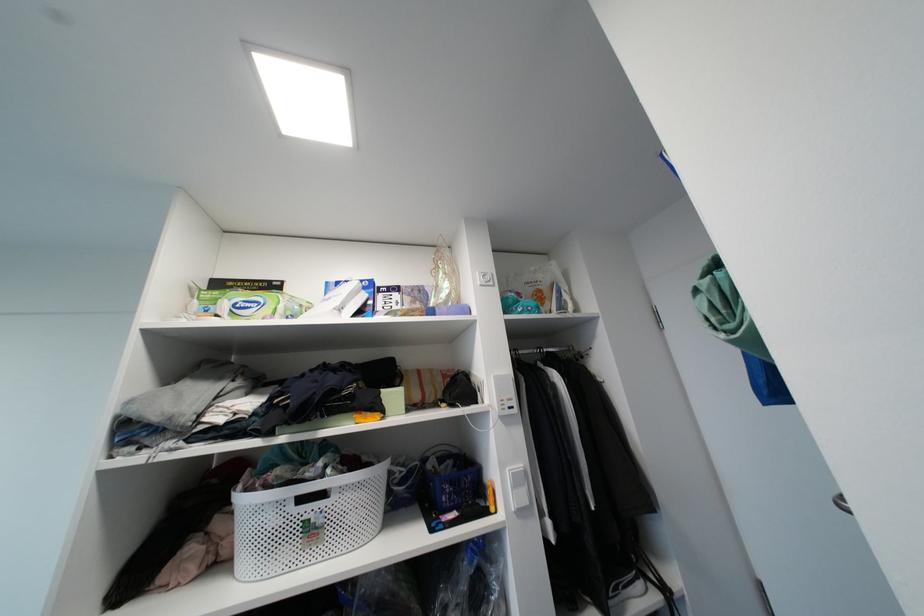
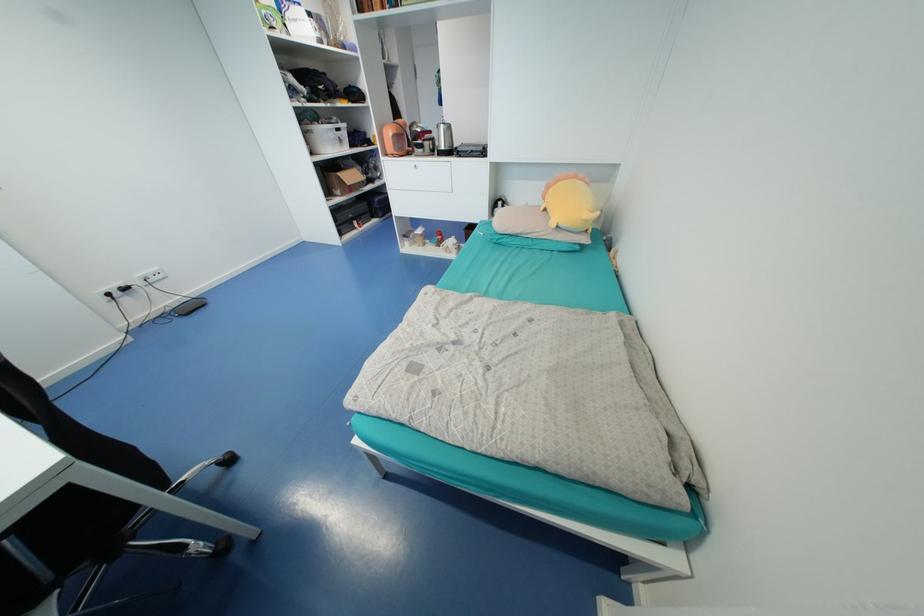
Question: I am providing you with two images of the same scene from different viewpoints. Which of the following objects are not visible in image2?

Choices:
 (A) red waste bin
 (B) yellow plush toy
 (C) green rolled-up bag
 (D) black electronic device

Answer: (C)